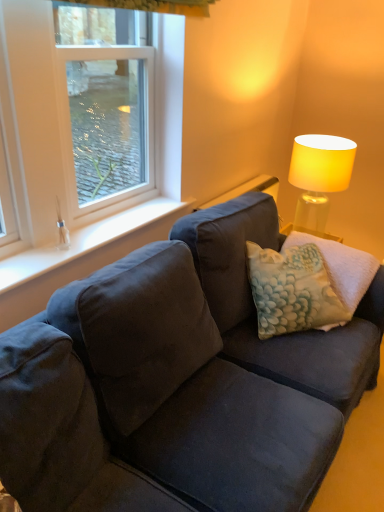
What are the coordinates of `white plastic window at upper left` in the screenshot? It's located at (69, 142).

What is the approximate height of silky white curtain at upper center?

It is 8.66 centimeters.

What is the approximate width of silky white curtain at upper center?

It is 8.65 inches.

Describe the element at coordinates (83, 242) in the screenshot. I see `white smooth window sill at lower left` at that location.

Where is `white plastic window at upper left`? white plastic window at upper left is located at coordinates (69, 142).

From the picture: Could you tell me if white smooth window sill at lower left is facing textured cream pillow at center?

No, white smooth window sill at lower left is not oriented towards textured cream pillow at center.

Would you say white smooth window sill at lower left is outside textured cream pillow at center?

white smooth window sill at lower left is positioned outside textured cream pillow at center.

The height and width of the screenshot is (512, 384). I want to click on window sill in front of the textured cream pillow at center, so click(83, 242).

Would you say white smooth window sill at lower left is a long distance from textured cream pillow at center?

That's not correct — white smooth window sill at lower left is a little close to textured cream pillow at center.

Can you confirm if matte yellow fabric lampshade at upper right is positioned to the right of textured cream pillow at center?

Correct, you'll find matte yellow fabric lampshade at upper right to the right of textured cream pillow at center.

From a real-world perspective, is matte yellow fabric lampshade at upper right beneath textured cream pillow at center?

No, from a real-world perspective, matte yellow fabric lampshade at upper right is not beneath textured cream pillow at center.

Is matte yellow fabric lampshade at upper right directly adjacent to textured cream pillow at center?

There is a gap between matte yellow fabric lampshade at upper right and textured cream pillow at center.

In the scene shown: Is matte yellow fabric lampshade at upper right aimed at textured cream pillow at center?

Yes, matte yellow fabric lampshade at upper right is aimed at textured cream pillow at center.

Considering the relative sizes of white smooth window sill at lower left and white plastic window at upper left in the image provided, is white smooth window sill at lower left taller than white plastic window at upper left?

No, white smooth window sill at lower left is not taller than white plastic window at upper left.

Image resolution: width=384 pixels, height=512 pixels. What are the coordinates of `window sill below the white plastic window at upper left (from the image's perspective)` in the screenshot? It's located at (83, 242).

Is white smooth window sill at lower left to the left of white plastic window at upper left from the viewer's perspective?

In fact, white smooth window sill at lower left is to the right of white plastic window at upper left.

Is matte yellow fabric lampshade at upper right positioned with its back to white smooth window sill at lower left?

matte yellow fabric lampshade at upper right does not have its back to white smooth window sill at lower left.

Does point (294, 181) come in front of point (142, 206)?

No, (294, 181) is further to viewer.

Is white smooth window sill at lower left completely or partially inside matte yellow fabric lampshade at upper right?

No, white smooth window sill at lower left is not surrounded by matte yellow fabric lampshade at upper right.

Is matte yellow fabric lampshade at upper right further to camera compared to white smooth window sill at lower left?

That is True.

Between textured cream pillow at center and matte yellow fabric lampshade at upper right, which one has larger width?

textured cream pillow at center is wider.

Where is `pillow below the matte yellow fabric lampshade at upper right (from a real-world perspective)`? This screenshot has height=512, width=384. pillow below the matte yellow fabric lampshade at upper right (from a real-world perspective) is located at coordinates (292, 290).

From a real-world perspective, is textured cream pillow at center on matte yellow fabric lampshade at upper right?

Incorrect, from a real-world perspective, textured cream pillow at center is lower than matte yellow fabric lampshade at upper right.

Which is more to the left, textured cream pillow at center or matte yellow fabric lampshade at upper right?

textured cream pillow at center.

From the image's perspective, is textured cream pillow at center located above or below white smooth window sill at lower left?

Clearly, from the image's perspective, textured cream pillow at center is below white smooth window sill at lower left.

Considering the sizes of textured cream pillow at center and white smooth window sill at lower left in the image, is textured cream pillow at center taller or shorter than white smooth window sill at lower left?

Clearly, textured cream pillow at center is taller compared to white smooth window sill at lower left.

How different are the orientations of textured cream pillow at center and white smooth window sill at lower left in degrees?

39.8 degrees.

Looking at their sizes, would you say white plastic window at upper left is wider or thinner than white smooth window sill at lower left?

Clearly, white plastic window at upper left has less width compared to white smooth window sill at lower left.

Does white plastic window at upper left appear on the right side of white smooth window sill at lower left?

Incorrect, white plastic window at upper left is not on the right side of white smooth window sill at lower left.

From the image's perspective, between white plastic window at upper left and white smooth window sill at lower left, who is located below?

white smooth window sill at lower left is shown below in the image.

Identify the location of pillow below the white smooth window sill at lower left (from the image's perspective). (292, 290).

The height and width of the screenshot is (512, 384). I want to click on table lamp that appears above the textured cream pillow at center (from the image's perspective), so click(x=319, y=176).

From the image, which object appears to be nearer to silky white curtain at upper center, white smooth window sill at lower left or textured cream pillow at center?

Based on the image, white smooth window sill at lower left appears to be nearer to silky white curtain at upper center.

Considering their positions, is silky white curtain at upper center positioned closer to matte yellow fabric lampshade at upper right than white smooth window sill at lower left?

silky white curtain at upper center.

Looking at the image, which one is located further to white plastic window at upper left, textured cream pillow at center or silky white curtain at upper center?

Among the two, textured cream pillow at center is located further to white plastic window at upper left.

Which object lies nearer to the anchor point matte yellow fabric lampshade at upper right, white plastic window at upper left or silky white curtain at upper center?

silky white curtain at upper center lies closer to matte yellow fabric lampshade at upper right than the other object.

When comparing their distances from white smooth window sill at lower left, does matte yellow fabric lampshade at upper right or silky white curtain at upper center seem closer?

silky white curtain at upper center lies closer to white smooth window sill at lower left than the other object.

Estimate the real-world distances between objects in this image. Which object is further from textured cream pillow at center, white plastic window at upper left or matte yellow fabric lampshade at upper right?

white plastic window at upper left is positioned further to the anchor textured cream pillow at center.

Based on their spatial positions, is matte yellow fabric lampshade at upper right or white smooth window sill at lower left closer to white plastic window at upper left?

white smooth window sill at lower left is positioned closer to the anchor white plastic window at upper left.

Based on their spatial positions, is white smooth window sill at lower left or textured cream pillow at center further from white plastic window at upper left?

Among the two, textured cream pillow at center is located further to white plastic window at upper left.

Find the location of `curtain between white smooth window sill at lower left and matte yellow fabric lampshade at upper right from left to right`. curtain between white smooth window sill at lower left and matte yellow fabric lampshade at upper right from left to right is located at coordinates (152, 5).

Image resolution: width=384 pixels, height=512 pixels. What are the coordinates of `pillow located between silky white curtain at upper center and matte yellow fabric lampshade at upper right in the depth direction` in the screenshot? It's located at (292, 290).

This screenshot has width=384, height=512. I want to click on window between silky white curtain at upper center and white smooth window sill at lower left in the up-down direction, so click(x=69, y=142).

The height and width of the screenshot is (512, 384). In order to click on window between silky white curtain at upper center and textured cream pillow at center in the vertical direction in this screenshot , I will do `click(69, 142)`.